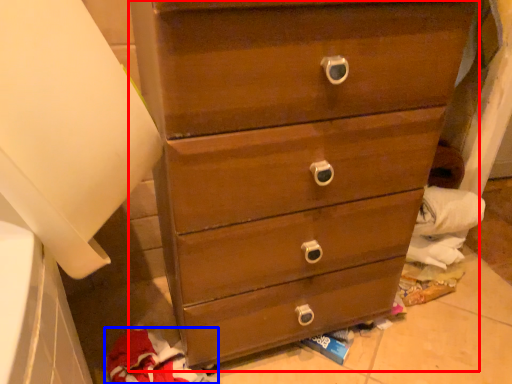
Question: Which object is further to the camera taking this photo, chest of drawers (highlighted by a red box) or clothing (highlighted by a blue box)?

Choices:
 (A) chest of drawers
 (B) clothing

Answer: (B)